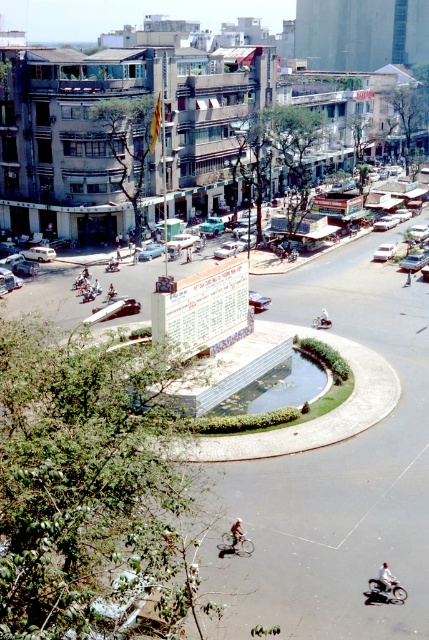
Is shiny silver motorcycle at center below metallic silver car at center?

Yes.

Is shiny silver motorcycle at center shorter than metallic silver car at center?

Yes.

The height and width of the screenshot is (640, 429). What are the coordinates of `shiny silver motorcycle at center` in the screenshot? It's located at (384, 593).

Is point (392, 577) farther from viewer compared to point (241, 529)?

No, (392, 577) is closer to viewer.

Which of these two, white matte motorcycle at center or light brown leather jacket at center, stands taller?

light brown leather jacket at center

Does point (395, 580) come behind point (242, 531)?

No, (395, 580) is closer to viewer.

Identify the location of white matte motorcycle at center. (386, 577).

Can you confirm if shiny silver motorcycle at center is positioned to the right of white glossy car at center?

Incorrect, shiny silver motorcycle at center is not on the right side of white glossy car at center.

Who is lower down, shiny silver motorcycle at center or white glossy car at center?

shiny silver motorcycle at center is lower down.

Does point (398, 593) come in front of point (392, 250)?

Yes, point (398, 593) is closer to viewer.

The image size is (429, 640). What are the coordinates of `shiny silver motorcycle at center` in the screenshot? It's located at (384, 593).